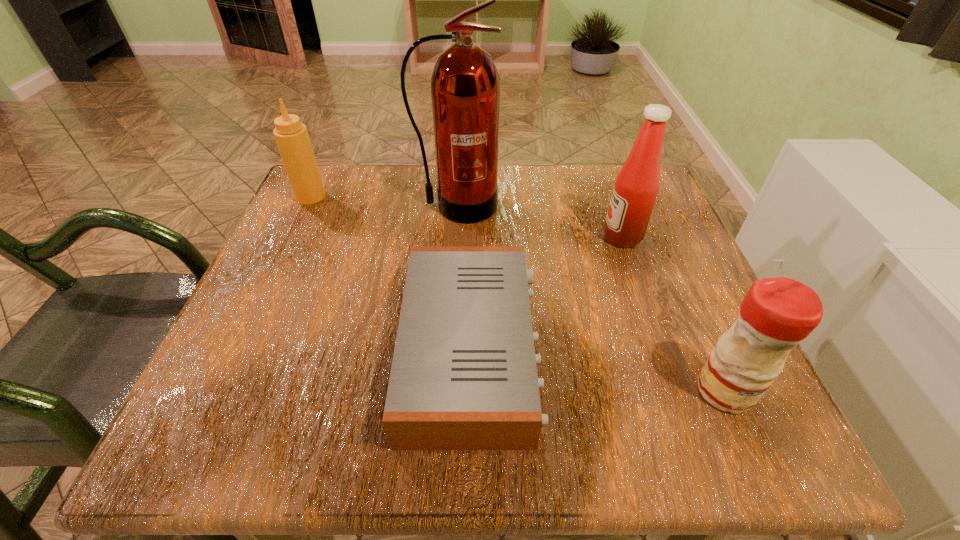
Where is `free space between the tallest object and the farthest condiment`? free space between the tallest object and the farthest condiment is located at coordinates (384, 201).

Image resolution: width=960 pixels, height=540 pixels. What are the coordinates of `free space that is in between the radio receiver and the nearest condiment` in the screenshot? It's located at click(x=598, y=370).

At what (x,y) coordinates should I click in order to perform the action: click on free space between the nearest condiment and the tallest condiment. Please return your answer as a coordinate pair (x, y). This screenshot has height=540, width=960. Looking at the image, I should click on (673, 314).

Locate an element on the screen. This screenshot has height=540, width=960. free space that is in between the leftmost object and the radio receiver is located at coordinates (392, 273).

I want to click on object that is the second closest to the radio receiver, so click(636, 187).

Locate which object ranks second in proximity to the shortest object. Please provide its 2D coordinates. Your answer should be formatted as a tuple, i.e. [(x, y)], where the tuple contains the x and y coordinates of a point satisfying the conditions above.

[(636, 187)]

This screenshot has width=960, height=540. Identify the location of the second closest condiment relative to the nearest condiment. (291, 136).

Locate which condiment ranks second in proximity to the shortest object. Please provide its 2D coordinates. Your answer should be formatted as a tuple, i.e. [(x, y)], where the tuple contains the x and y coordinates of a point satisfying the conditions above.

[(776, 314)]

You are a GUI agent. You are given a task and a screenshot of the screen. Output one action in this format:
    pyautogui.click(x=<x>, y=<y>)
    Task: Click on the free space that satisfies the following two spatial constraints: 1. on the front-facing side of the tallest condiment; 2. on the back side of the nearest condiment
    
    Given the screenshot: What is the action you would take?
    pyautogui.click(x=677, y=390)

The image size is (960, 540). I want to click on blank area in the image that satisfies the following two spatial constraints: 1. on the front side of the nearest condiment; 2. on the left side of the leftmost condiment, so click(220, 390).